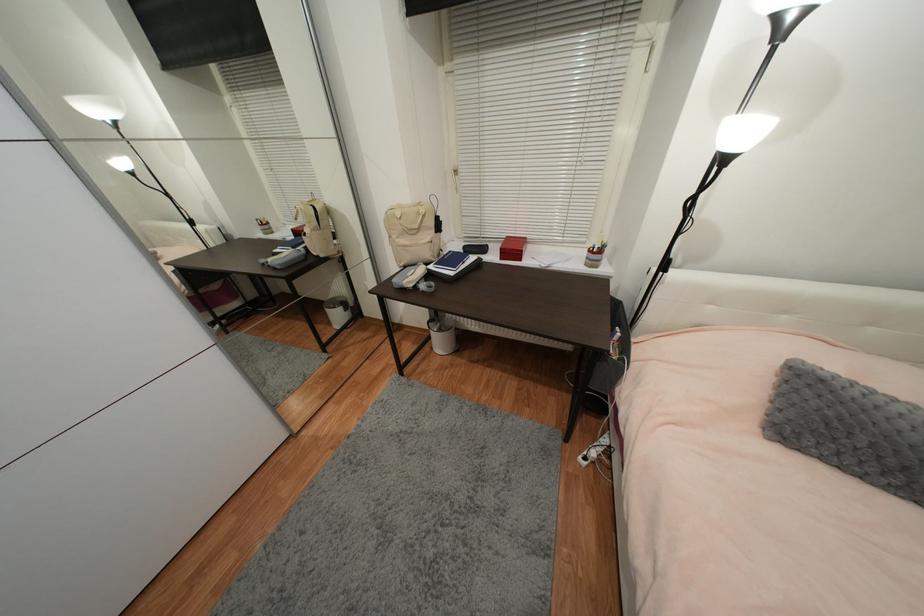
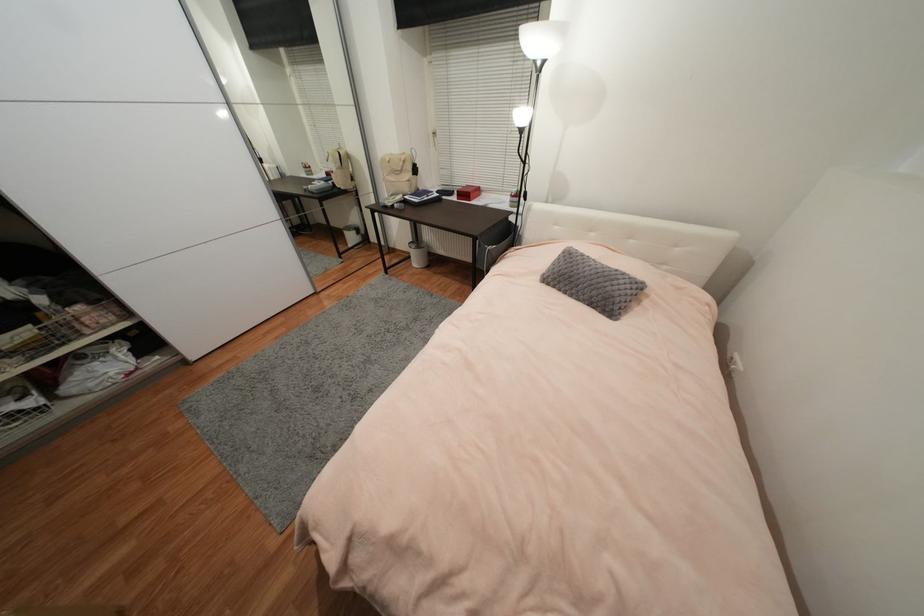
Where in the second image is the point corresponding to pixel 864 477 from the first image?

(569, 294)